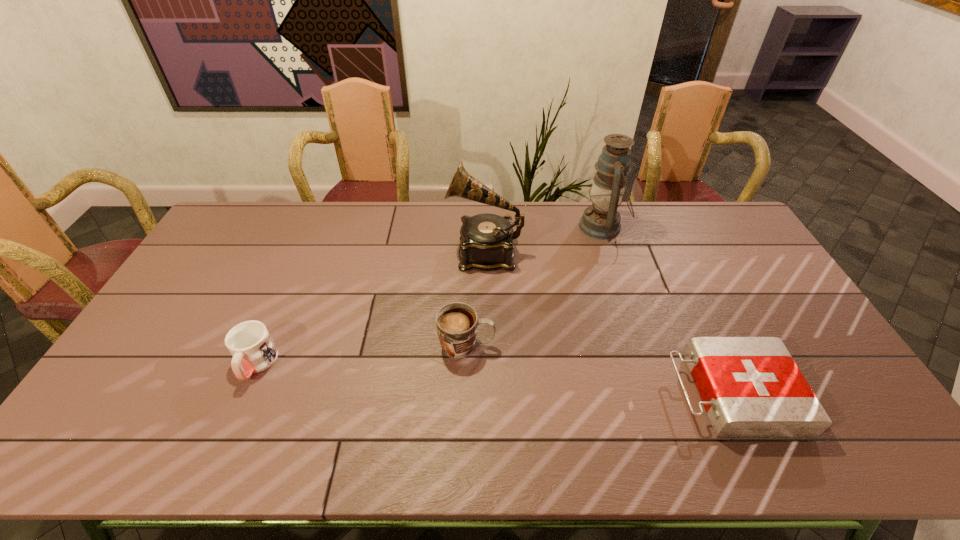
Locate an element on the screen. This screenshot has height=540, width=960. oil lamp is located at coordinates (601, 220).

Locate an element on the screen. phonograph record is located at coordinates (486, 239).

Where is `the third tallest object`? This screenshot has width=960, height=540. the third tallest object is located at coordinates (457, 322).

Where is `the taller mug`? The height and width of the screenshot is (540, 960). the taller mug is located at coordinates (457, 322).

Locate an element on the screen. the left mug is located at coordinates (253, 350).

Where is `the fourth tallest object`? Image resolution: width=960 pixels, height=540 pixels. the fourth tallest object is located at coordinates (253, 350).

This screenshot has height=540, width=960. Find the location of `the shortest object`. the shortest object is located at coordinates (751, 388).

Locate an element on the screen. vacant space located on the right of the oil lamp is located at coordinates (711, 227).

Find the location of a particular element. The width and height of the screenshot is (960, 540). vacant space located on the horn of the phonograph record is located at coordinates (387, 252).

Find the location of `free location located 0.160m on the horn of the phonograph record`. free location located 0.160m on the horn of the phonograph record is located at coordinates (401, 252).